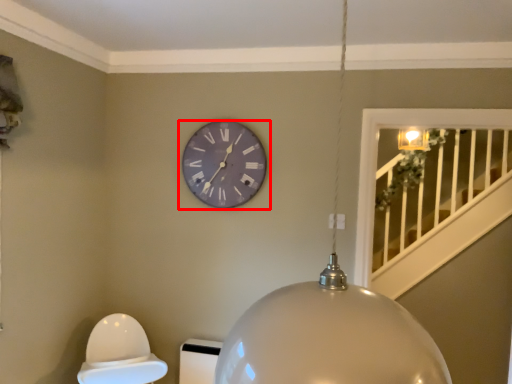
Question: From the image's perspective, where is wall clock (annotated by the red box) located relative to lamp?

Choices:
 (A) above
 (B) below

Answer: (A)